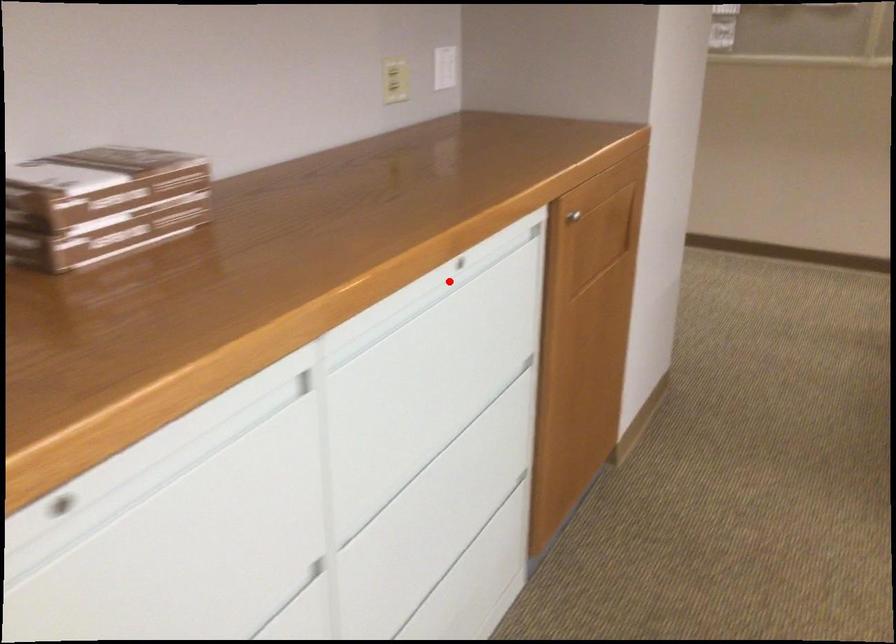
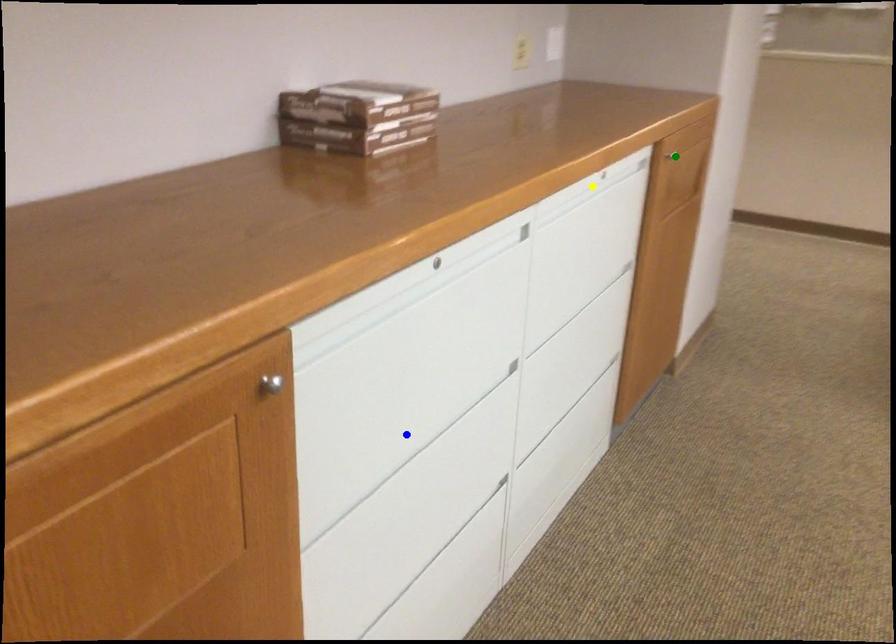
Question: I am providing you with two images of the same scene from different viewpoints. A red point is marked on the first image. You are given multiple points on the second image. Can you choose the point in image 2 that corresponds to the point in image 1?

Choices:
 (A) yellow point
 (B) blue point
 (C) green point

Answer: (A)